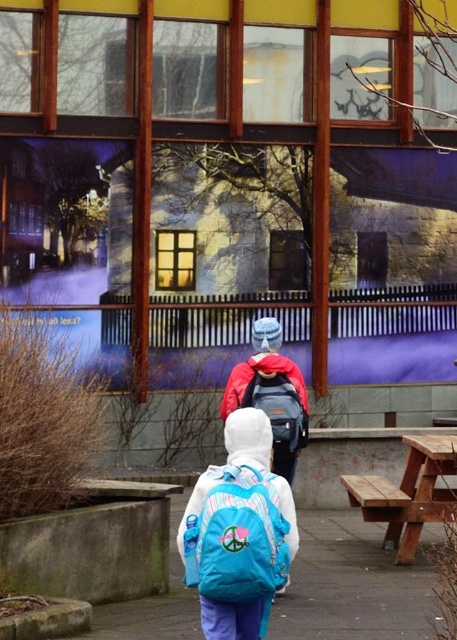
Consider the image. You are planning to place the matte blue backpack at center onto the brown wooden picnic table at lower right. Based on their sizes, will the backpack fit on the table?

The brown wooden picnic table at lower right is wider than the matte blue backpack at center, so the backpack will fit on the table.

You are standing in the scene and need to place a small potted plant that is 1 meter tall. Which object, the brown wooden picnic table at lower right or the matte blue backpack at center, can the potted plant be placed on top of without exceeding its height?

The brown wooden picnic table at lower right is taller than the matte blue backpack at center. Since the potted plant is 1 meter tall, it can be placed on the brown wooden picnic table at lower right as it has sufficient height to accommodate the plant without exceeding its own height.